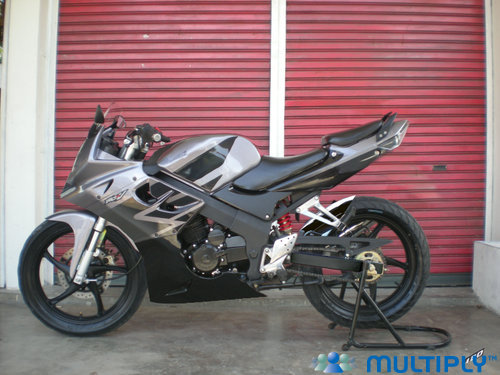
The image size is (500, 375). What are the coordinates of `door` in the screenshot? It's located at (175, 51).